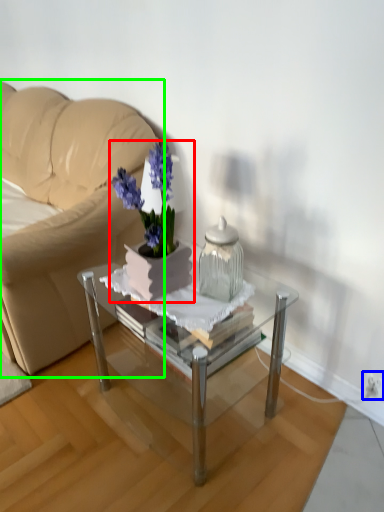
Question: Which object is the closest to the houseplant (highlighted by a red box)? Choose among these: electric outlet (highlighted by a blue box) or studio couch (highlighted by a green box).

Choices:
 (A) electric outlet
 (B) studio couch

Answer: (B)